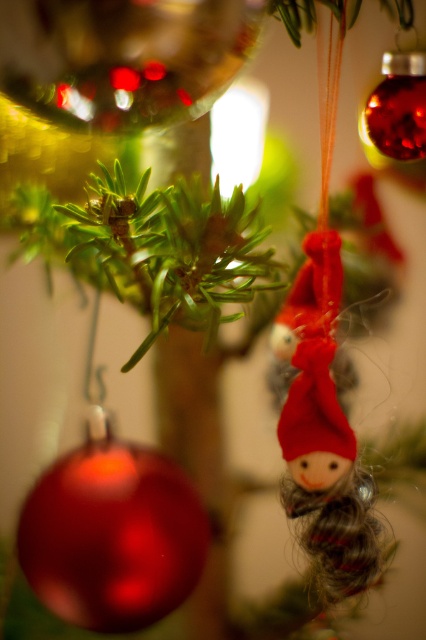
Question: Is glossy red bauble at center further to camera compared to matte red fabric doll at center?

Choices:
 (A) yes
 (B) no

Answer: (B)

Question: Can you confirm if glossy red bauble at center is positioned below matte red fabric doll at center?

Choices:
 (A) yes
 (B) no

Answer: (A)

Question: Which object is farther from the camera taking this photo?

Choices:
 (A) glossy red bauble at center
 (B) matte red fabric doll at center

Answer: (B)

Question: Does glossy red bauble at center lie behind matte red fabric doll at center?

Choices:
 (A) no
 (B) yes

Answer: (A)

Question: Which point is closer to the camera taking this photo?

Choices:
 (A) (331, 598)
 (B) (184, 509)

Answer: (B)